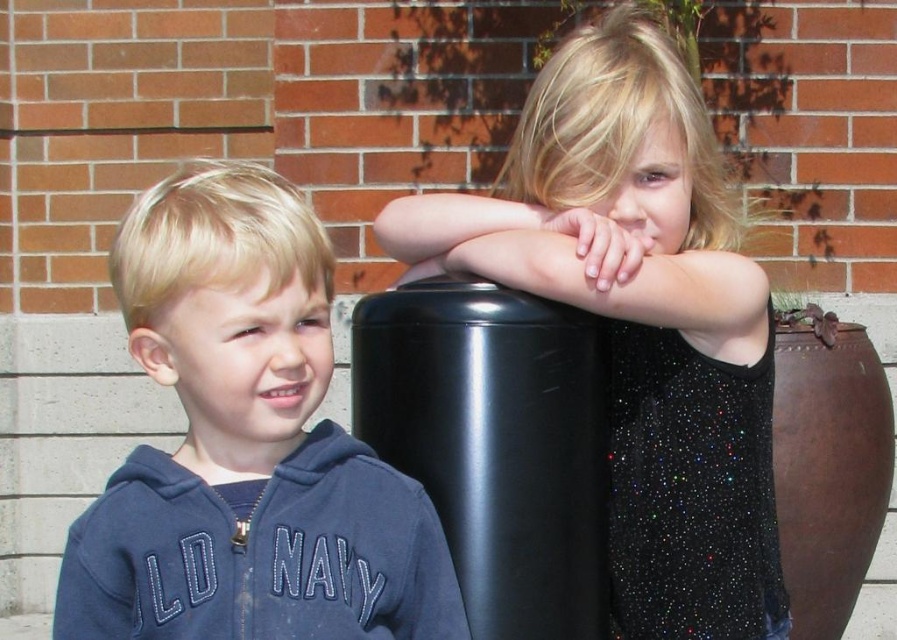
Can you confirm if sparkly black dress at upper right is bigger than blue fleece hoodie at left?

Yes, sparkly black dress at upper right is bigger than blue fleece hoodie at left.

Can you confirm if sparkly black dress at upper right is positioned above blue fleece hoodie at left?

Indeed, sparkly black dress at upper right is positioned over blue fleece hoodie at left.

Locate an element on the screen. sparkly black dress at upper right is located at coordinates (640, 317).

Is blue fleece hoodie at left below navy fleece sweatshirt at left?

No.

Which of these two, blue fleece hoodie at left or navy fleece sweatshirt at left, stands taller?

blue fleece hoodie at left is taller.

Does point (211, 253) come behind point (150, 545)?

That is False.

This screenshot has height=640, width=897. What are the coordinates of `blue fleece hoodie at left` in the screenshot? It's located at (246, 444).

What do you see at coordinates (640, 317) in the screenshot? I see `sparkly black dress at upper right` at bounding box center [640, 317].

Between point (556, 49) and point (166, 525), which one is positioned in front?

Point (166, 525) is in front.

The image size is (897, 640). In order to click on sparkly black dress at upper right in this screenshot , I will do `click(640, 317)`.

In order to click on sparkly black dress at upper right in this screenshot , I will do `click(640, 317)`.